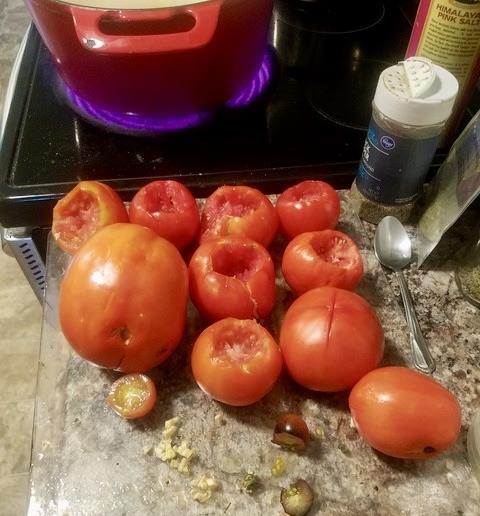
In order to click on handle in this screenshot , I will do `click(145, 40)`.